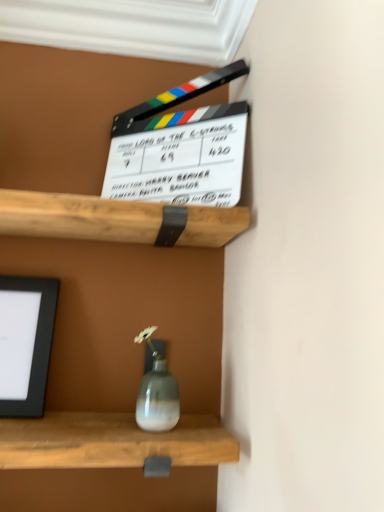
Question: From the image's perspective, is matte black picture frame at left under white smooth window frame at upper center?

Choices:
 (A) yes
 (B) no

Answer: (A)

Question: Is matte black picture frame at left wider than white smooth window frame at upper center?

Choices:
 (A) yes
 (B) no

Answer: (B)

Question: Is matte black picture frame at left oriented towards white smooth window frame at upper center?

Choices:
 (A) yes
 (B) no

Answer: (B)

Question: Is matte black picture frame at left not near white smooth window frame at upper center?

Choices:
 (A) no
 (B) yes

Answer: (A)

Question: Considering the relative sizes of matte black picture frame at left and white smooth window frame at upper center in the image provided, is matte black picture frame at left smaller than white smooth window frame at upper center?

Choices:
 (A) yes
 (B) no

Answer: (A)

Question: Considering the relative positions of matte black picture frame at left and white smooth window frame at upper center in the image provided, is matte black picture frame at left in front of white smooth window frame at upper center?

Choices:
 (A) no
 (B) yes

Answer: (A)

Question: Would you say white smooth window frame at upper center contains matte black picture frame at left?

Choices:
 (A) yes
 (B) no

Answer: (B)

Question: Would you consider white smooth window frame at upper center to be distant from matte black picture frame at left?

Choices:
 (A) no
 (B) yes

Answer: (A)

Question: Can we say white smooth window frame at upper center lies outside matte black picture frame at left?

Choices:
 (A) no
 (B) yes

Answer: (B)

Question: Is white smooth window frame at upper center bigger than matte black picture frame at left?

Choices:
 (A) yes
 (B) no

Answer: (A)

Question: From a real-world perspective, does white smooth window frame at upper center sit lower than matte black picture frame at left?

Choices:
 (A) yes
 (B) no

Answer: (B)

Question: Are white smooth window frame at upper center and matte black picture frame at left beside each other?

Choices:
 (A) yes
 (B) no

Answer: (B)

Question: Considering the relative positions of white smooth window frame at upper center and matte black picture frame at left in the image provided, is white smooth window frame at upper center to the left or to the right of matte black picture frame at left?

Choices:
 (A) left
 (B) right

Answer: (B)